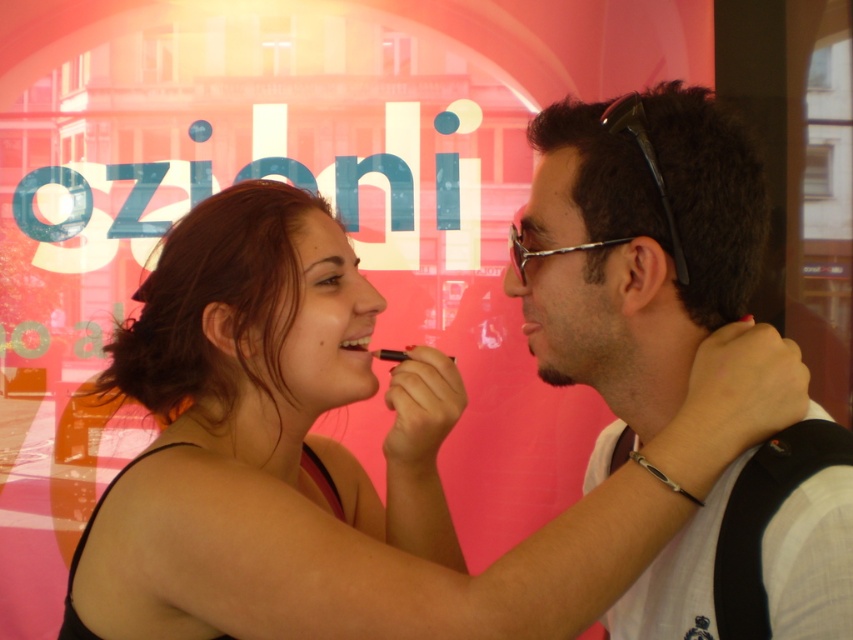
Question: Which is nearer to the dark brown hair at upper center?

Choices:
 (A) smooth skin face at center
 (B) matte white shirt at center
 (C) smooth skin girl at center
 (D) matte black lipstick at center

Answer: (D)

Question: Where is smooth skin face at center located in relation to dark brown hair at upper center in the image?

Choices:
 (A) below
 (B) above

Answer: (A)

Question: Can you confirm if smooth skin girl at center is bigger than matte black lipstick at center?

Choices:
 (A) yes
 (B) no

Answer: (A)

Question: Can you confirm if smooth skin girl at center is positioned below smooth skin face at center?

Choices:
 (A) yes
 (B) no

Answer: (A)

Question: Which point is closer to the camera?

Choices:
 (A) (306, 349)
 (B) (247, 568)

Answer: (B)

Question: Among these points, which one is farthest from the camera?

Choices:
 (A) (316, 273)
 (B) (613, 257)
 (C) (579, 234)
 (D) (473, 584)

Answer: (A)